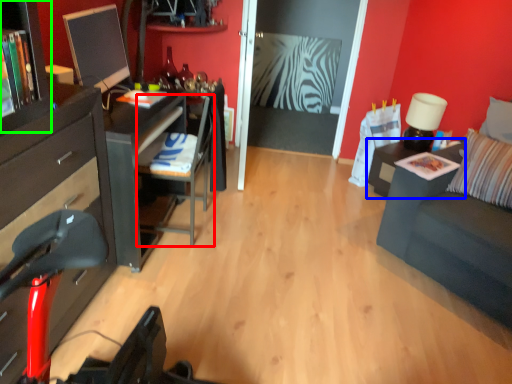
Question: Which is nearer to the armchair (highlighted by a red box)? nightstand (highlighted by a blue box) or tv cabinet (highlighted by a green box).

Choices:
 (A) nightstand
 (B) tv cabinet

Answer: (B)